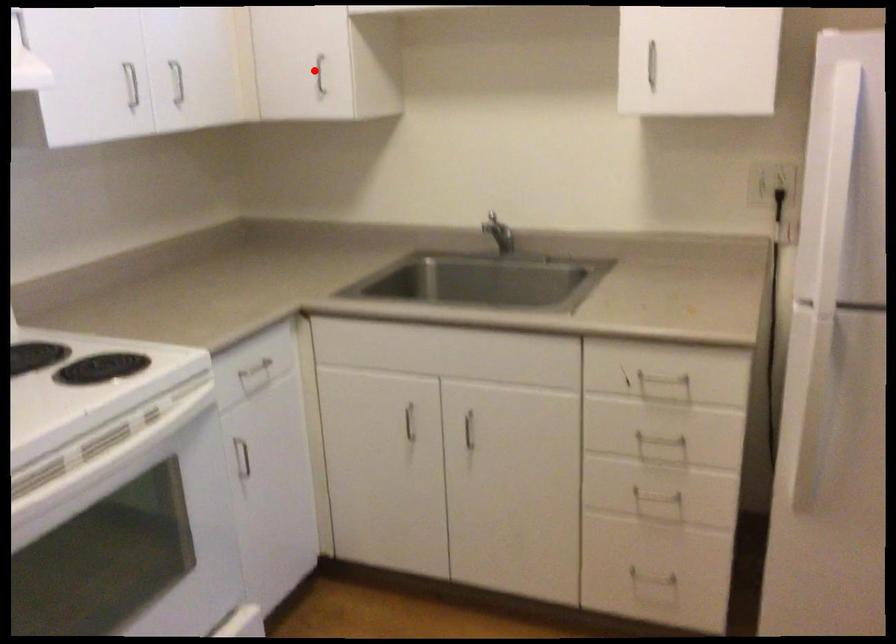
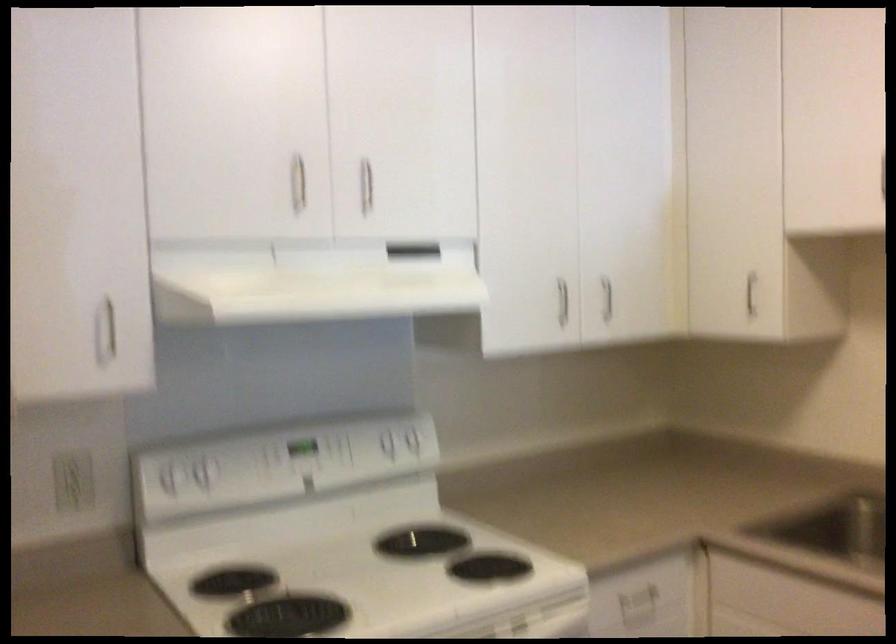
The point at the highlighted location is marked in the first image. Where is the corresponding point in the second image?

(751, 292)